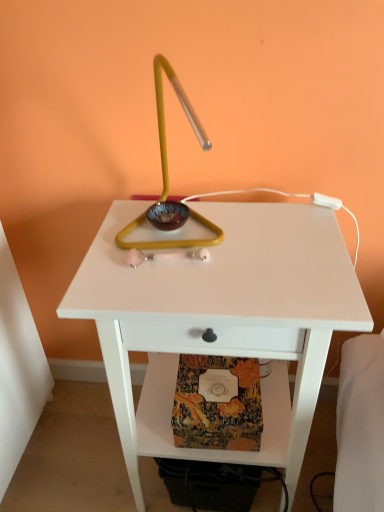
Locate an element on the screen. The height and width of the screenshot is (512, 384). white wood nightstand at center is located at coordinates (221, 319).

Describe the element at coordinates (221, 319) in the screenshot. The width and height of the screenshot is (384, 512). I see `white wood nightstand at center` at that location.

This screenshot has width=384, height=512. I want to click on white wood nightstand at center, so click(x=221, y=319).